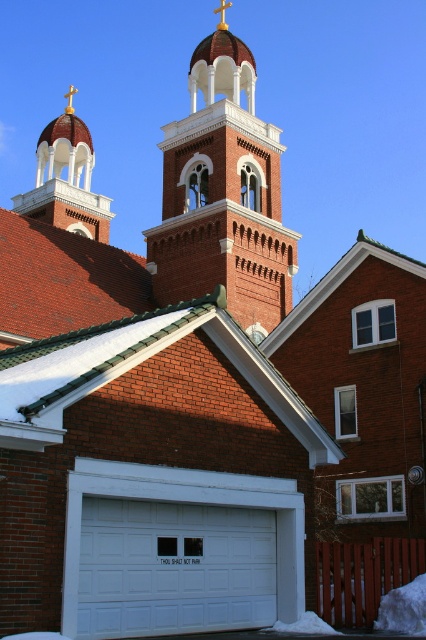
You are an architect assessing the building structure. You notice the brick bell tower at center and the white painted wood garage door at center. Which structure has a greater overall size?

The brick bell tower at center is larger in size than the white painted wood garage door at center, so the brick bell tower at center has a greater overall size.

You are standing in front of the brick building and want to take a photo of the gold cross at upper center. However, you notice the brick bell tower at center might block your view. Based on their positions, will the tower obstruct the cross in your photo?

The brick bell tower at center is below the gold cross at upper center, so the tower will not obstruct the cross in your photo since it is positioned lower than the cross.